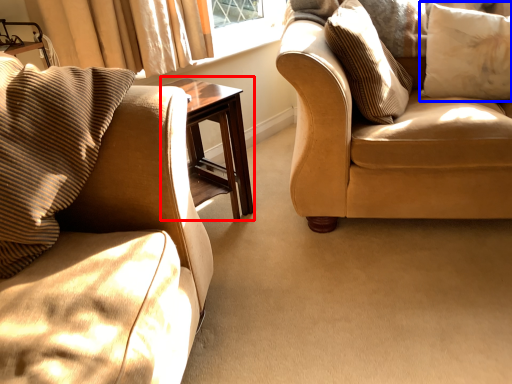
Question: Which object appears closest to the camera in this image, table (highlighted by a red box) or pillow (highlighted by a blue box)?

Choices:
 (A) table
 (B) pillow

Answer: (A)